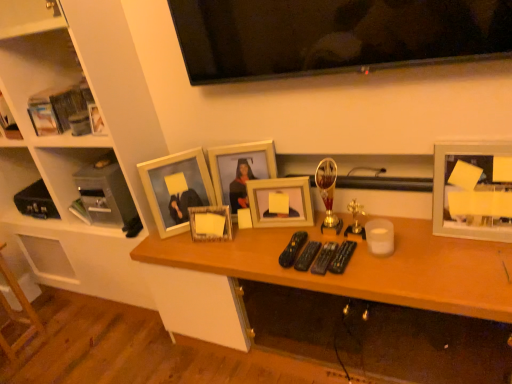
The width and height of the screenshot is (512, 384). Identify the location of empty space that is ontop of matte gray cabinet at left (from a real-world perspective). (95, 158).